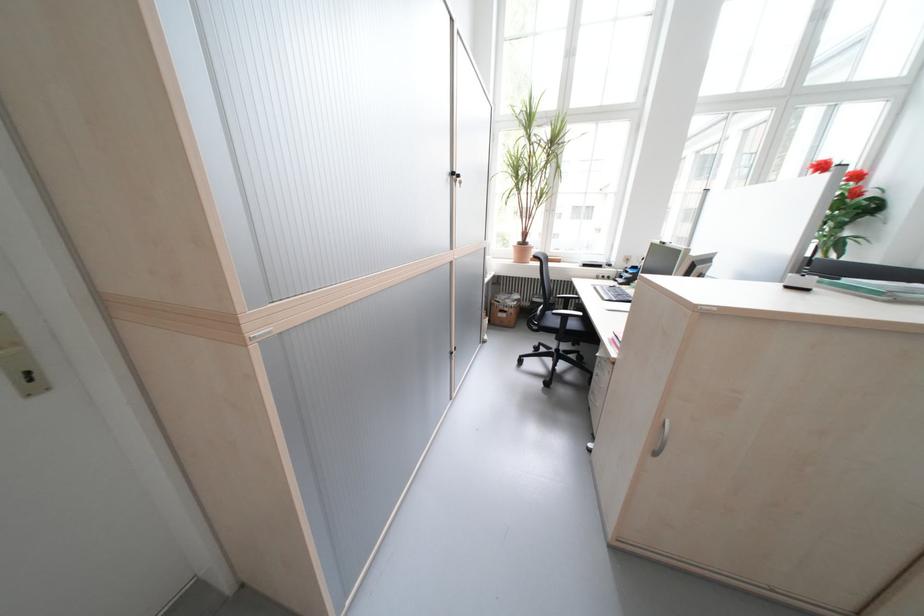
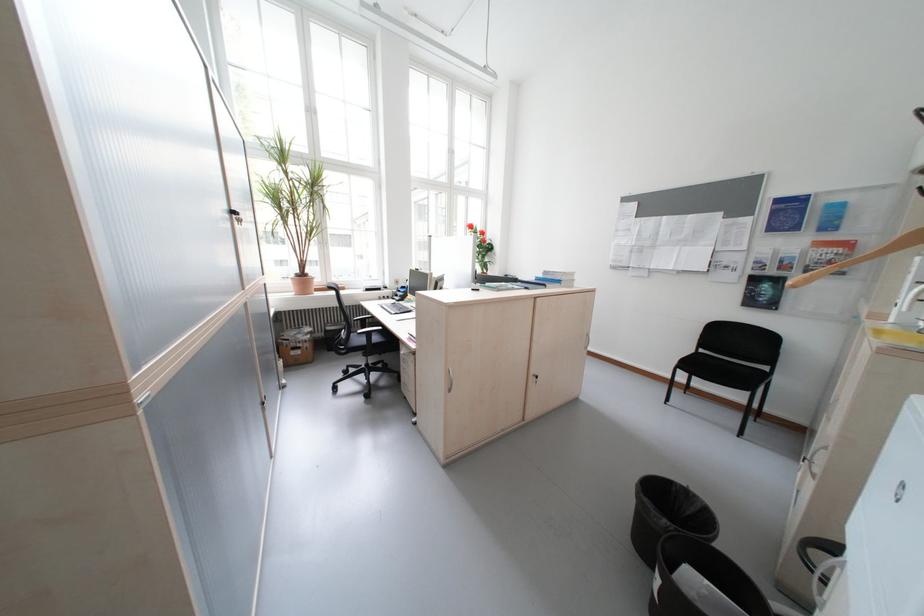
Find the pixel in the second image that matches [529,245] in the first image.

(308, 277)